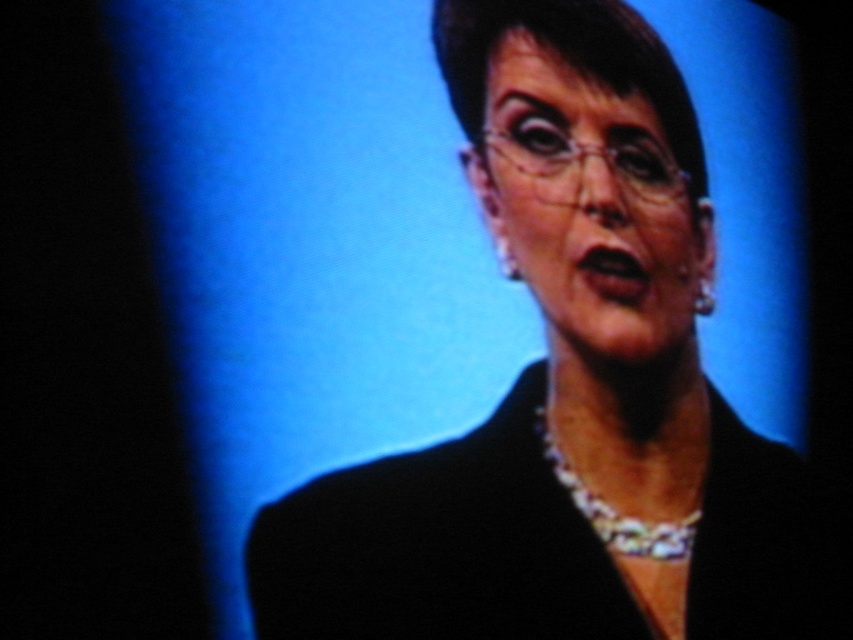
You are a photographer adjusting the lighting for a portrait session. You notice the black glossy suit at center and the silver metallic necklace at center in the frame. Which object is positioned more to the left in the image?

The silver metallic necklace at center is positioned more to the left than the black glossy suit at center, as the black glossy suit at center is to the right of the silver metallic necklace at center.

Based on the scene description, which object is positioned higher between the black glossy suit at center and the black matte business suit at center?

The black glossy suit at center is positioned higher than the black matte business suit at center according to the description.